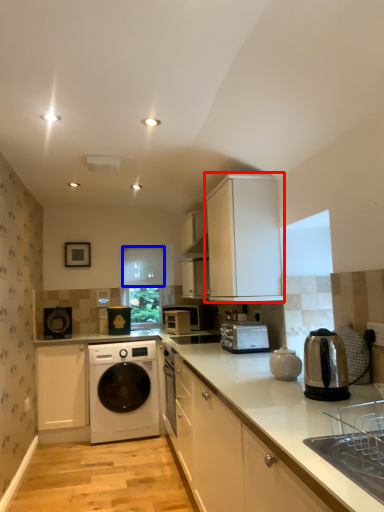
Question: Among these objects, which one is farthest to the camera, cabinetry (highlighted by a red box) or window screen (highlighted by a blue box)?

Choices:
 (A) cabinetry
 (B) window screen

Answer: (B)